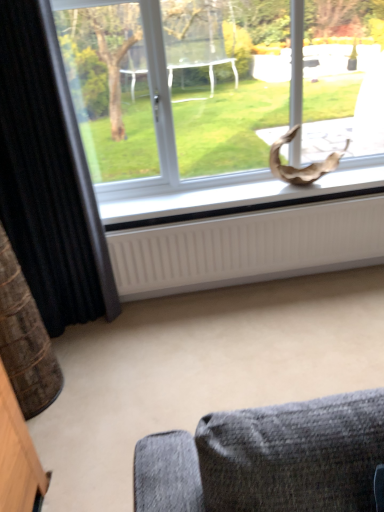
Where is `blank space situated above white ribbed radiator at lower center (from a real-world perspective)`? blank space situated above white ribbed radiator at lower center (from a real-world perspective) is located at coordinates (x=228, y=211).